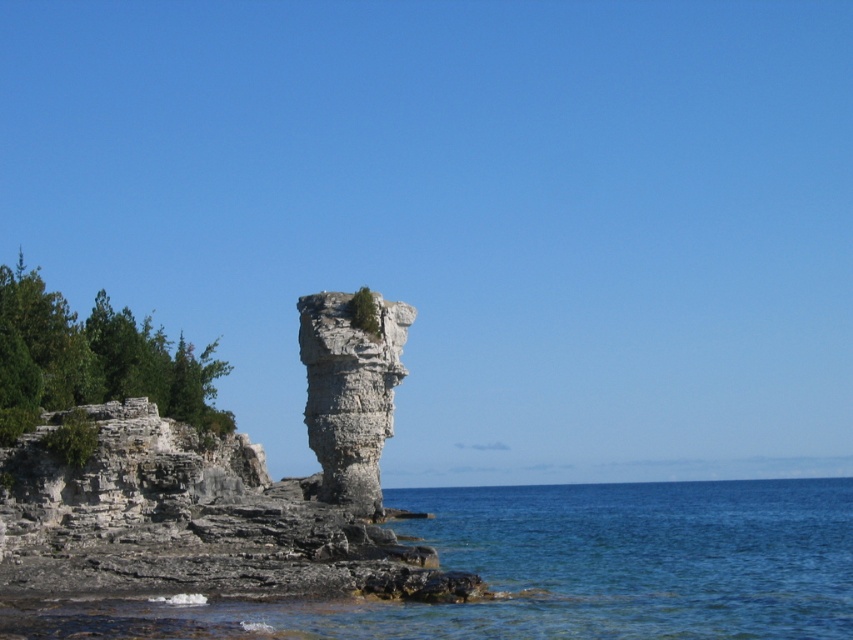
Based on the photo, you are standing at the base of the rock pillar and want to take a photo of the green leafy tree at left. If your camera has a maximum zoom range of 50 meters, will you be able to capture the entire tree in the photo without moving closer?

The green leafy tree at left and viewer are 77.28 meters apart, which exceeds the camera maximum zoom range of 50 meters. Therefore, you will not be able to capture the entire tree in the photo without moving closer.

You are standing at the base of the rock pillar in the image. There are two points marked on the rock formation. Which point, point [498,612] or point [344,436], is closer to you?

Point [498,612] is closer to the viewer than point [344,436].

You are a hiker standing on the rocky shoreline looking at the gray stone column at center and the green leafy tree at left. Which object is taller from your viewpoint?

The green leafy tree at left is taller than the gray stone column at center according to the description.